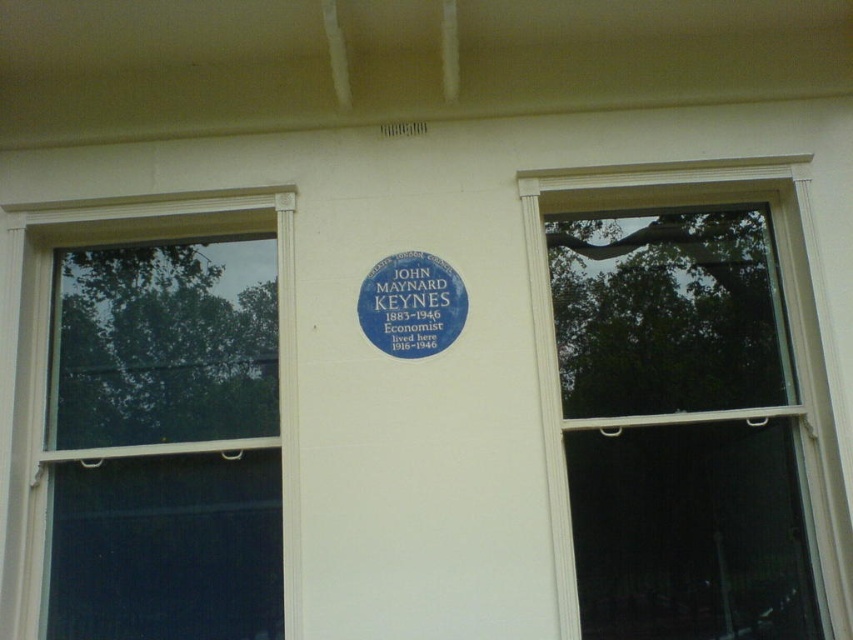
Question: Which point is closer to the camera taking this photo?

Choices:
 (A) (294, 548)
 (B) (840, 628)
 (C) (358, 320)

Answer: (B)

Question: Which of these objects is positioned farthest from the white plastic window at left?

Choices:
 (A) blue metallic plaque at center
 (B) transparent glass window at upper right

Answer: (B)

Question: Can you confirm if transparent glass window at upper right is positioned above white plastic window at left?

Choices:
 (A) yes
 (B) no

Answer: (A)

Question: Is transparent glass window at upper right closer to the viewer compared to blue metallic plaque at center?

Choices:
 (A) yes
 (B) no

Answer: (A)

Question: Is white plastic window at left smaller than blue metallic plaque at center?

Choices:
 (A) yes
 (B) no

Answer: (B)

Question: Which point is closer to the camera?

Choices:
 (A) transparent glass window at upper right
 (B) white plastic window at left

Answer: (A)